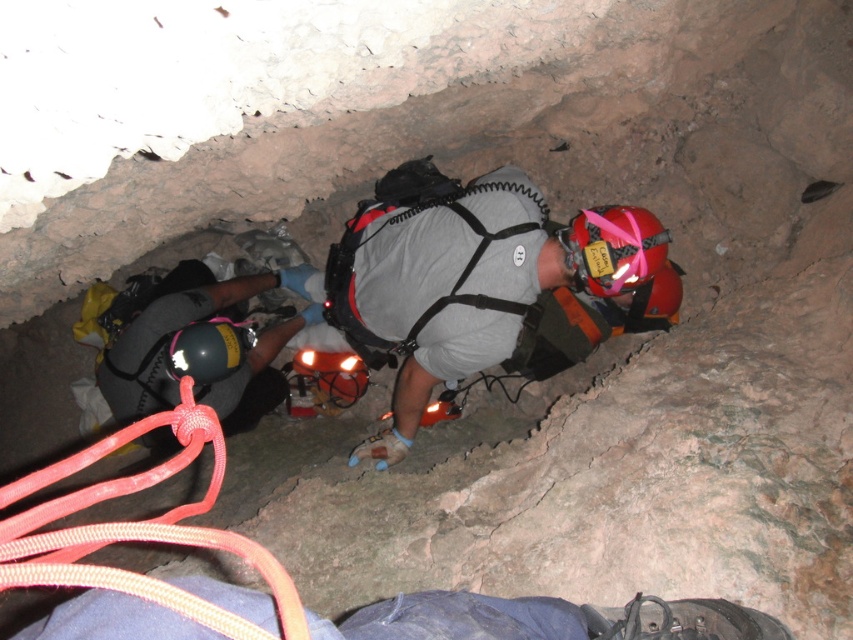
Is red matte helmet at center smaller than orange matte helmet at center?

No.

Does red matte helmet at center have a lesser width compared to orange matte helmet at center?

Indeed, red matte helmet at center has a lesser width compared to orange matte helmet at center.

Find the location of a particular element. The height and width of the screenshot is (640, 853). red matte helmet at center is located at coordinates (613, 248).

Which of these two, blue fabric bag at lower center or red nylon rope at lower left, stands shorter?

blue fabric bag at lower center

Can you confirm if blue fabric bag at lower center is positioned to the right of red nylon rope at lower left?

Indeed, blue fabric bag at lower center is positioned on the right side of red nylon rope at lower left.

Locate an element on the screen. blue fabric bag at lower center is located at coordinates (463, 618).

Where is `blue fabric bag at lower center`? The width and height of the screenshot is (853, 640). blue fabric bag at lower center is located at coordinates (463, 618).

Which of these two, brushed metal helmet at lower left or black matte helmet at lower left, stands shorter?

black matte helmet at lower left is shorter.

Measure the distance between point (146, 380) and camera.

Point (146, 380) is 9.19 feet away from camera.

Find the location of `brushed metal helmet at lower left`. brushed metal helmet at lower left is located at coordinates (172, 333).

This screenshot has width=853, height=640. I want to click on brushed metal helmet at lower left, so click(x=172, y=333).